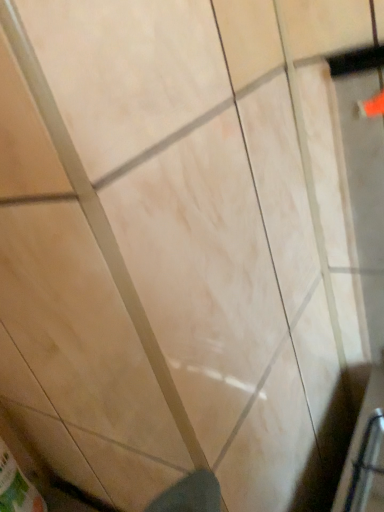
Locate an element on the screen. The image size is (384, 512). green plastic bottle at bottom left is located at coordinates (17, 486).

The image size is (384, 512). What do you see at coordinates (17, 486) in the screenshot?
I see `green plastic bottle at bottom left` at bounding box center [17, 486].

Locate an element on the screen. green plastic bottle at bottom left is located at coordinates (17, 486).